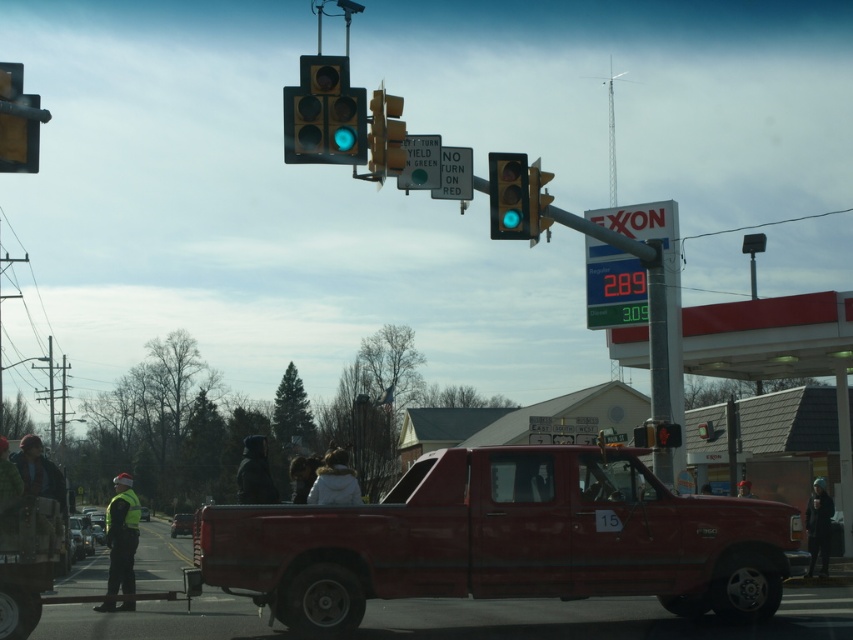
Question: Which point is farther from the camera taking this photo?

Choices:
 (A) (22, 449)
 (B) (666, 467)

Answer: (B)

Question: Is metallic traffic light at upper left positioned behind dark fabric jacket at center?

Choices:
 (A) no
 (B) yes

Answer: (A)

Question: Can you confirm if matte glass traffic light at upper center is positioned to the left of metallic traffic light at upper left?

Choices:
 (A) no
 (B) yes

Answer: (A)

Question: In this image, where is matte glass traffic light at center located relative to white fur coat at center?

Choices:
 (A) right
 (B) left

Answer: (A)

Question: Which point appears closest to the camera in this image?

Choices:
 (A) (315, 150)
 (B) (32, 116)

Answer: (B)

Question: Among these points, which one is farthest from the camera?

Choices:
 (A) (245, 490)
 (B) (12, 472)

Answer: (A)